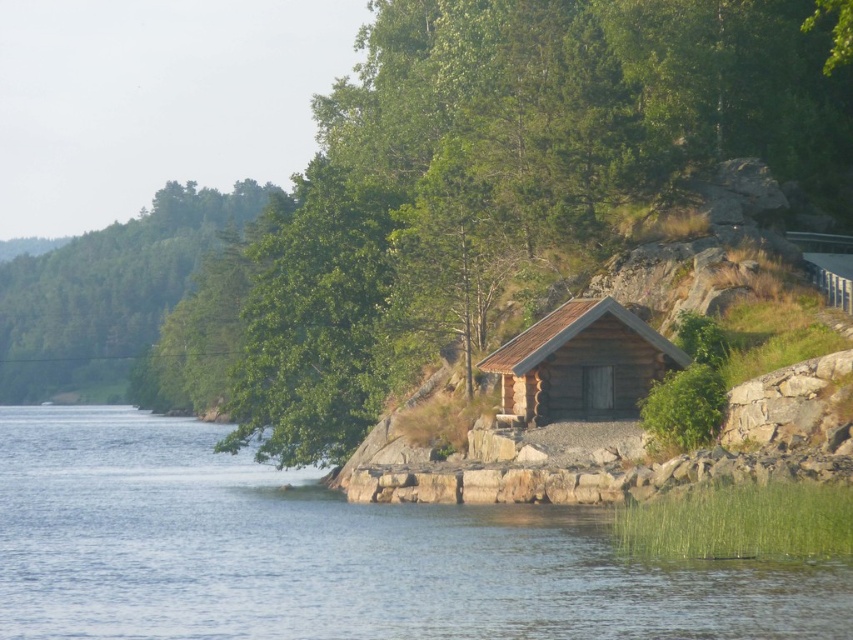
Measure the distance between green leafy tree at left and brown wooden log cabin at center-right.

green leafy tree at left is 141.74 meters from brown wooden log cabin at center-right.

Who is positioned more to the left, green leafy tree at left or brown wooden log cabin at center-right?

green leafy tree at left is more to the left.

Locate an element on the screen. The width and height of the screenshot is (853, 640). green leafy tree at left is located at coordinates (109, 292).

You are a GUI agent. You are given a task and a screenshot of the screen. Output one action in this format:
    pyautogui.click(x=<x>, y=<y>)
    Task: Click on the green leafy tree at left
    The width and height of the screenshot is (853, 640).
    Given the screenshot: What is the action you would take?
    pyautogui.click(x=109, y=292)

Which is more to the right, transparent blue water at lower left or brown wooden log cabin at center-right?

brown wooden log cabin at center-right

Is transparent blue water at lower left to the right of brown wooden log cabin at center-right from the viewer's perspective?

No, transparent blue water at lower left is not to the right of brown wooden log cabin at center-right.

At what (x,y) coordinates should I click in order to perform the action: click on transparent blue water at lower left. Please return your answer as a coordinate pair (x, y). Looking at the image, I should click on (332, 554).

Image resolution: width=853 pixels, height=640 pixels. I want to click on transparent blue water at lower left, so click(x=332, y=554).

Does transparent blue water at lower left have a larger size compared to green leafy tree at left?

No, transparent blue water at lower left is not bigger than green leafy tree at left.

Is point (329, 528) more distant than point (126, 332)?

That is False.

Locate an element on the screen. transparent blue water at lower left is located at coordinates (332, 554).